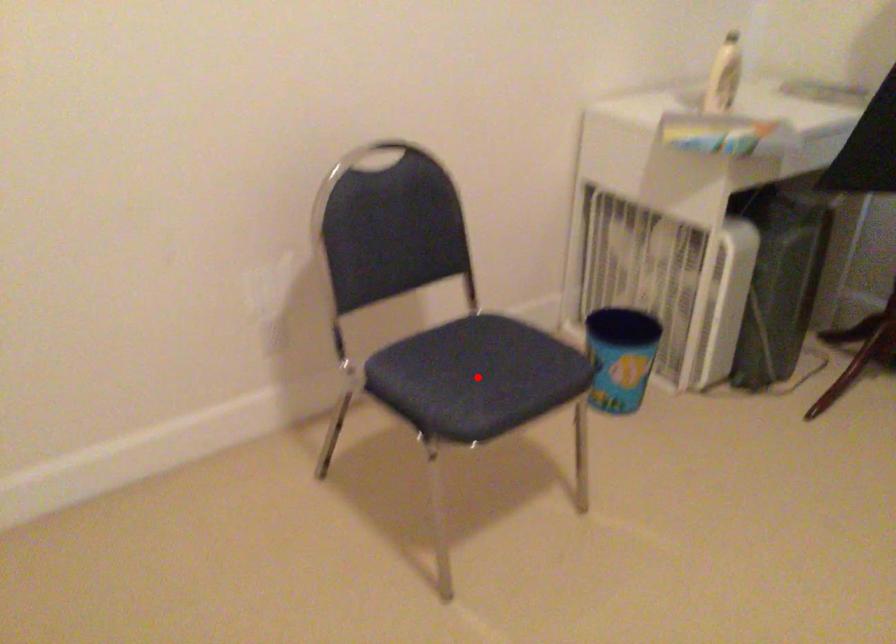
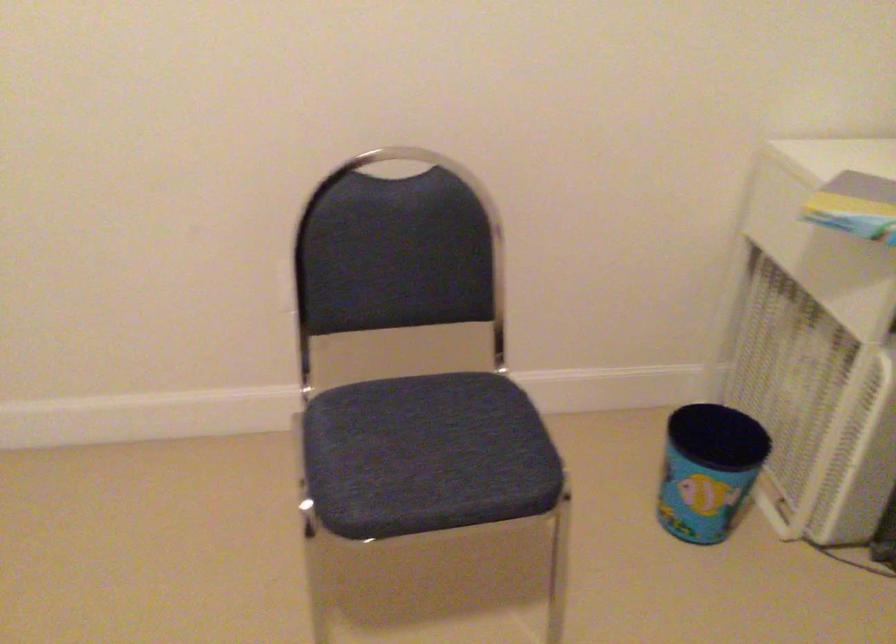
Locate, in the second image, the point that corresponds to the highlighted location in the first image.

(426, 455)